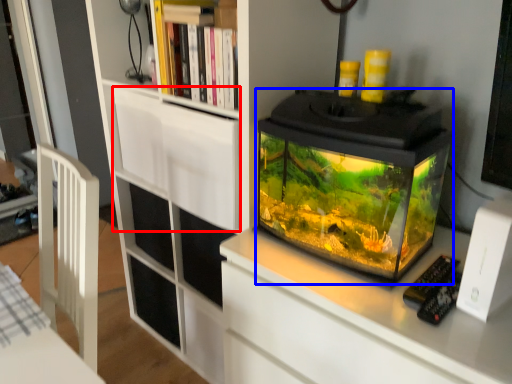
Question: Among these objects, which one is farthest to the camera, drawer (highlighted by a red box) or glass box (highlighted by a blue box)?

Choices:
 (A) drawer
 (B) glass box

Answer: (A)